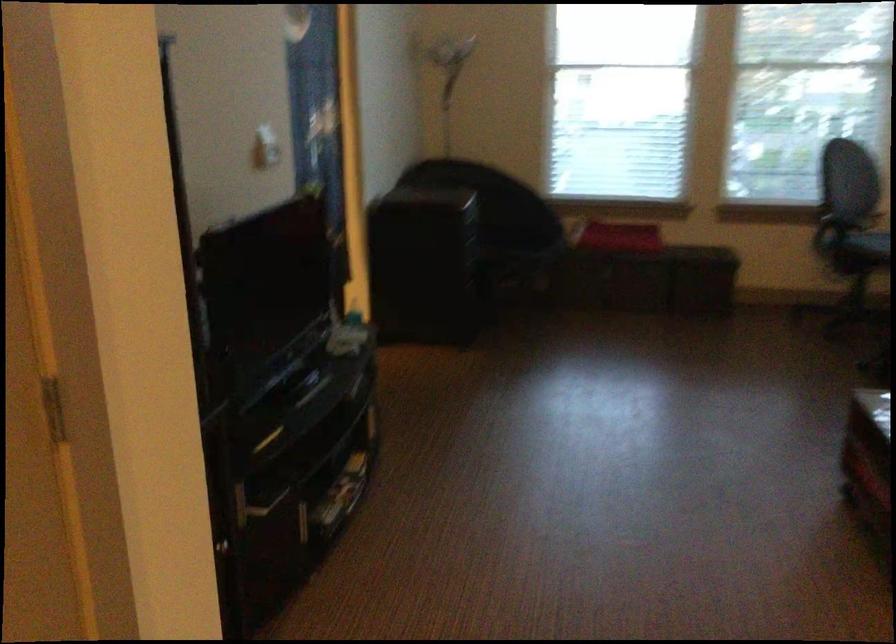
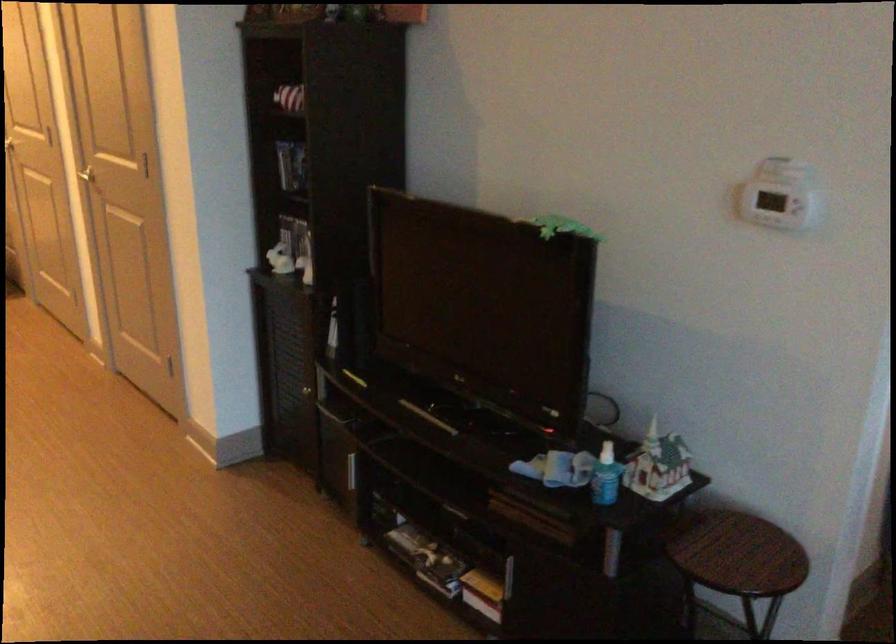
Where in the second image is the point corresponding to (348,332) from the first image?

(733, 547)